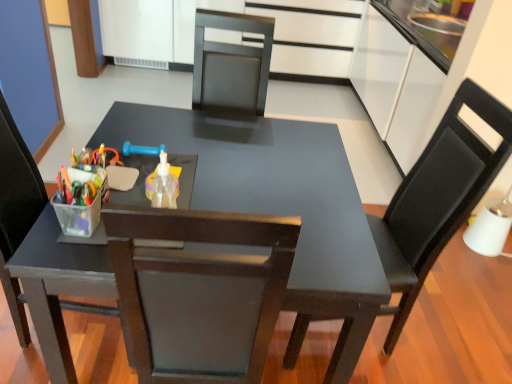
The image size is (512, 384). Identify the location of free space to the back side of translucent plastic bottle at center. click(197, 181).